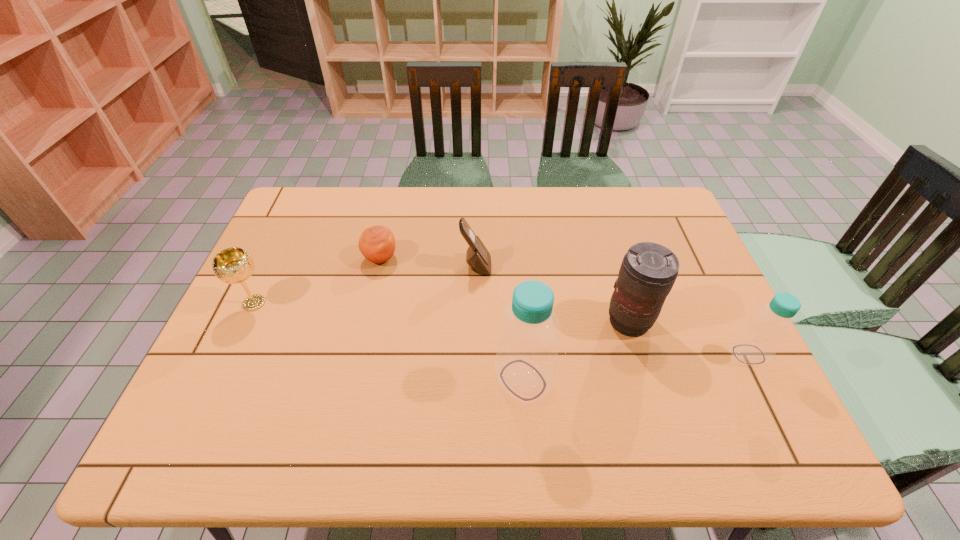
Locate an element on the screen. free space between the chalice and the taller bottle is located at coordinates (389, 341).

Where is `free space between the cellular telephone and the chalice`? The height and width of the screenshot is (540, 960). free space between the cellular telephone and the chalice is located at coordinates (365, 285).

Identify which object is located as the fifth nearest to the orange. Please provide its 2D coordinates. Your answer should be formatted as a tuple, i.e. [(x, y)], where the tuple contains the x and y coordinates of a point satisfying the conditions above.

[(757, 342)]

Select which object appears as the second closest to the left bottle. Please provide its 2D coordinates. Your answer should be formatted as a tuple, i.e. [(x, y)], where the tuple contains the x and y coordinates of a point satisfying the conditions above.

[(478, 258)]

The width and height of the screenshot is (960, 540). Find the location of `free location that satisfies the following two spatial constraints: 1. on the front side of the leftmost object; 2. on the right side of the tallest object`. free location that satisfies the following two spatial constraints: 1. on the front side of the leftmost object; 2. on the right side of the tallest object is located at coordinates (218, 380).

Identify the location of free space that satisfies the following two spatial constraints: 1. on the front-facing side of the cellular telephone; 2. on the back side of the taller bottle. (475, 380).

Find the location of a particular element. The height and width of the screenshot is (540, 960). blank area in the image that satisfies the following two spatial constraints: 1. on the front-facing side of the cellular telephone; 2. on the left side of the taller bottle is located at coordinates (475, 380).